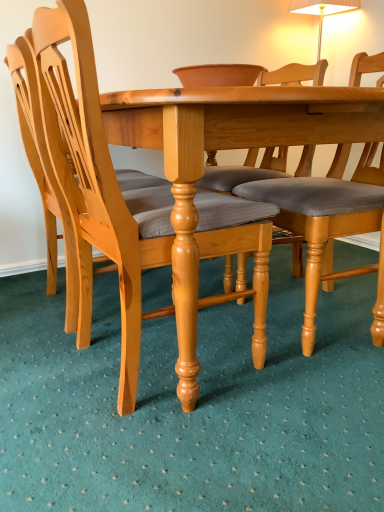
Locate an element on the screen. This screenshot has width=384, height=512. free point to the left of light wood chair at left, which is counted as the 1th chair, starting from the left is located at coordinates (21, 303).